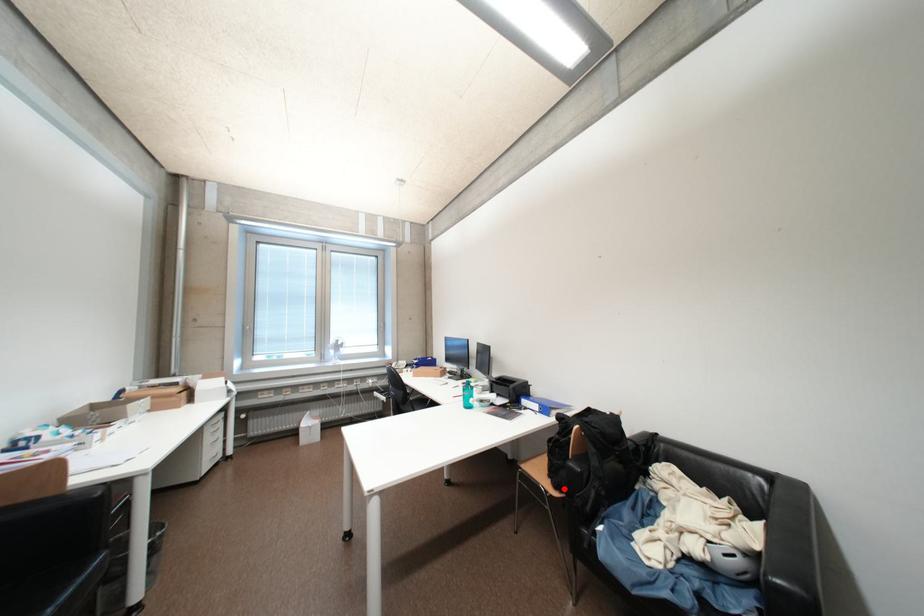
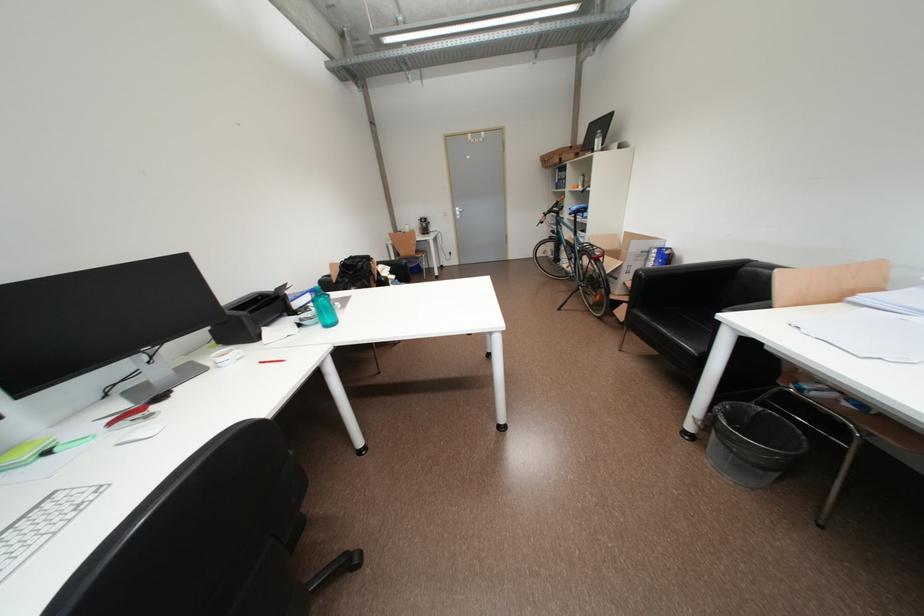
Question: I am providing you with two images of the same scene from different viewpoints. A red point is marked on the first image. At the location where the point appears in image 1, is it still visible in image 2?

Choices:
 (A) Yes
 (B) No

Answer: (B)